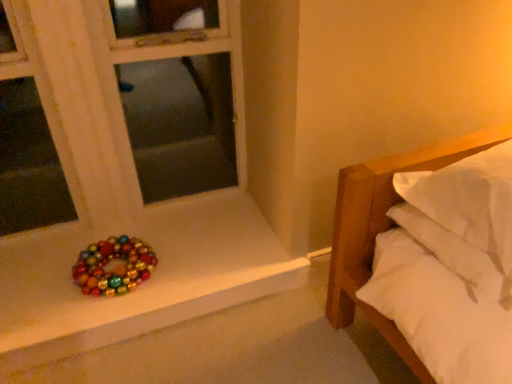
Locate an element on the screen. Image resolution: width=512 pixels, height=384 pixels. vacant area on top of multicolored baubles at lower left (from a real-world perspective) is located at coordinates (155, 254).